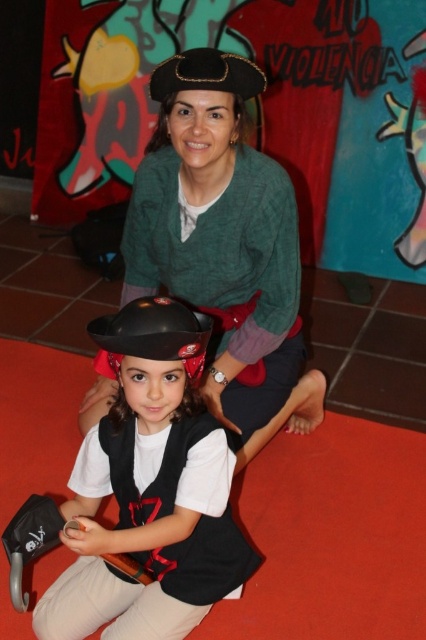
In the scene shown: You are a costume designer preparing for a pirate play. You need to arrange the matte green sweater at center and the shiny black helmet at lower left on a display rack. According to the image, which item should be placed higher on the rack?

The matte green sweater at center should be placed higher on the rack because it is positioned above the shiny black helmet at lower left in the image.

Based on the coordinates provided, which object in the scene is exactly at point (224, 244)?

The matte green sweater at center is exactly at point (224, 244).

You are organizing a costume party and need to decide which item takes up more space. Based on the scene, which object is larger between the matte green sweater at center and the shiny black helmet at lower left?

The matte green sweater at center is larger in size than the shiny black helmet at lower left, so the matte green sweater at center takes up more space.